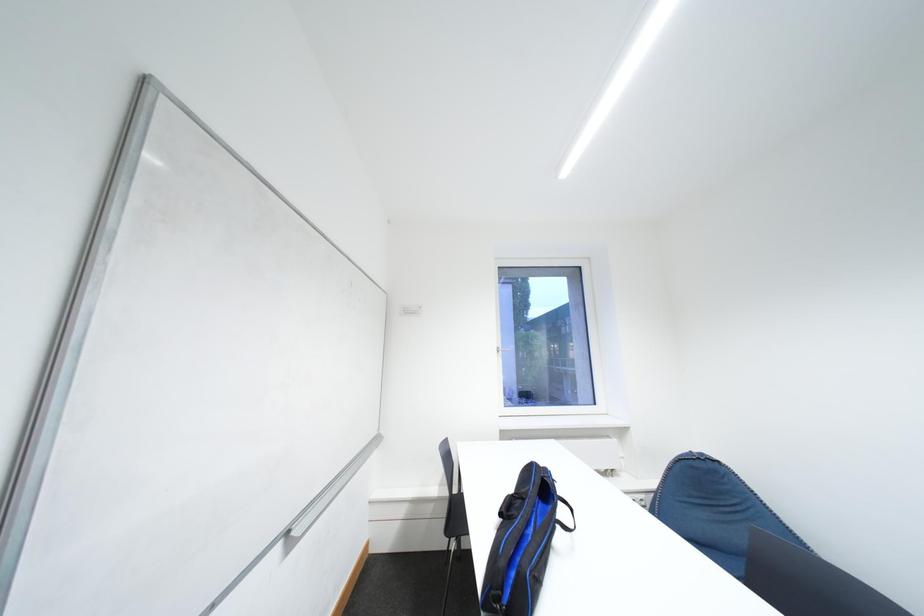
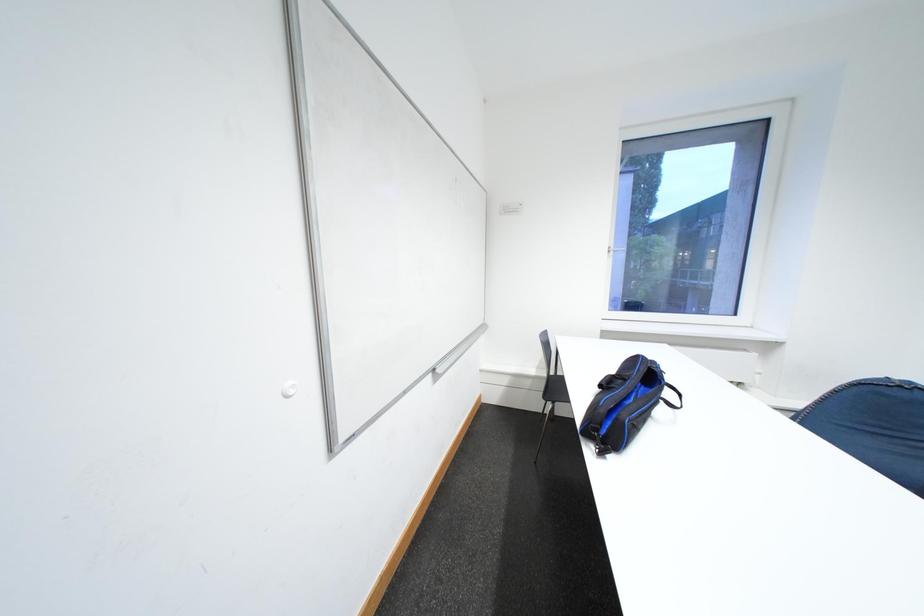
In a continuous first-person perspective shot, in which direction is the camera moving?

The cameraman walked toward left, backward.